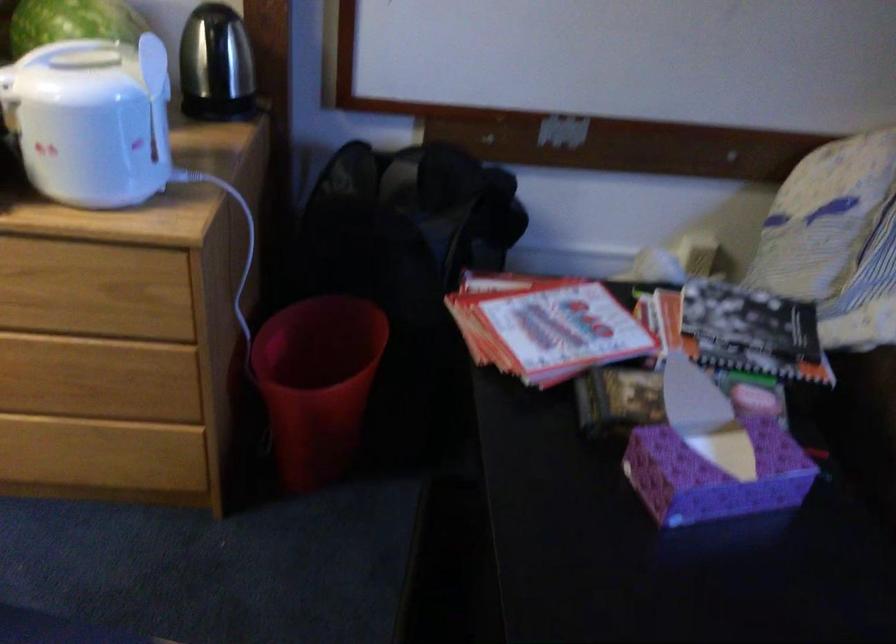
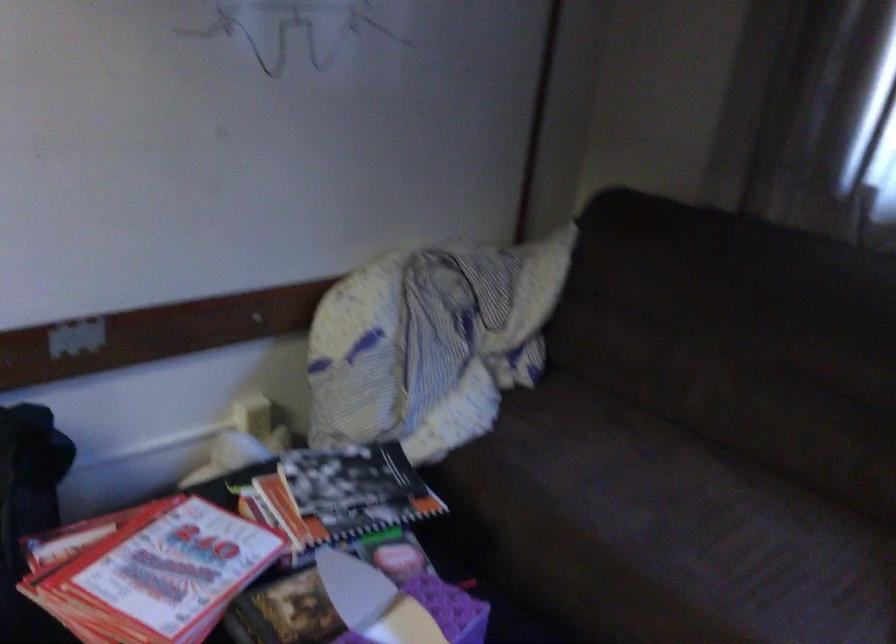
Question: The camera is either moving clockwise (left) or counter-clockwise (right) around the object. The first image is from the beginning of the video and the second image is from the end. Is the camera moving left or right when shooting the video?

Choices:
 (A) Left
 (B) Right

Answer: (A)